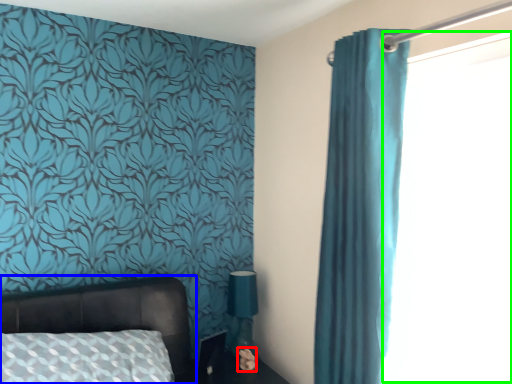
Question: Which object is positioned farthest from flower (highlighted by a red box)? Select from bed (highlighted by a blue box) and window screen (highlighted by a green box).

Choices:
 (A) bed
 (B) window screen

Answer: (B)